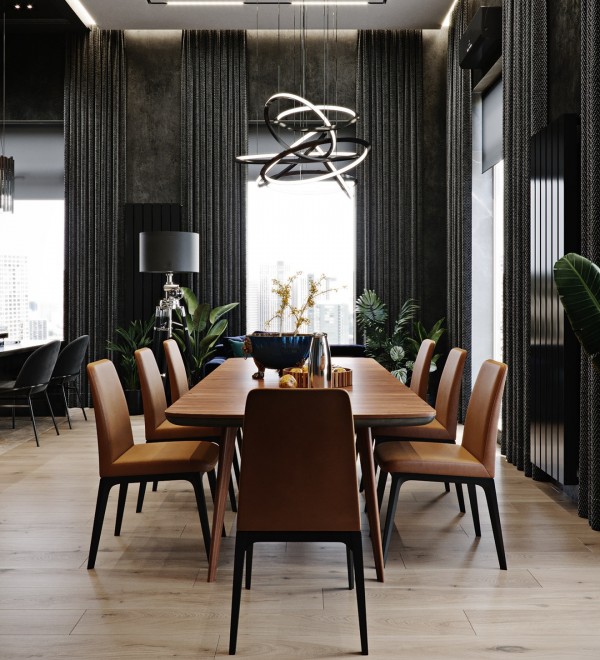
Where is `chandelier`? The width and height of the screenshot is (600, 660). chandelier is located at coordinates (328, 117).